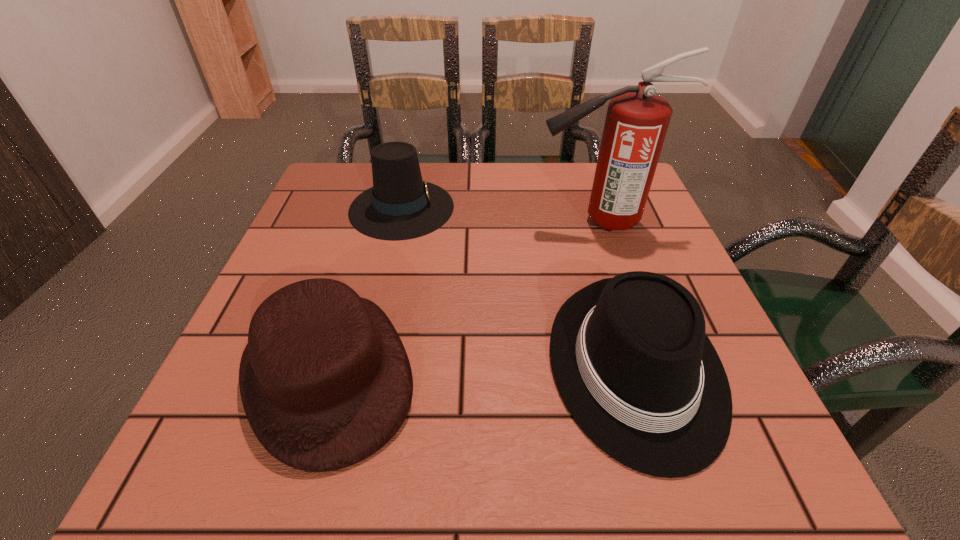
In the image, there is a desktop. Find the location of `free space at the near edge`. free space at the near edge is located at coordinates (513, 429).

This screenshot has height=540, width=960. What are the coordinates of `free spot at the left edge of the desktop` in the screenshot? It's located at (232, 385).

This screenshot has height=540, width=960. In the image, there is a desktop. What are the coordinates of `vacant space at the far left corner` in the screenshot? It's located at (305, 212).

Where is `vacant point located between the shorter hat and the taller hat`? This screenshot has width=960, height=540. vacant point located between the shorter hat and the taller hat is located at coordinates (366, 290).

Identify the location of free space between the fedora and the shorter hat. (483, 370).

At what (x,y) coordinates should I click in order to perform the action: click on unoccupied area between the farther hat and the shorter hat. Please return your answer as a coordinate pair (x, y). This screenshot has width=960, height=540. Looking at the image, I should click on (366, 290).

What are the coordinates of `free space between the shorter hat and the fedora` in the screenshot? It's located at (483, 370).

Image resolution: width=960 pixels, height=540 pixels. In order to click on vacant space in between the tallest object and the farther hat in this screenshot , I will do `click(500, 214)`.

You are a GUI agent. You are given a task and a screenshot of the screen. Output one action in this format:
    pyautogui.click(x=<x>, y=<y>)
    Task: Click on the free space between the fedora and the shorter hat
    The height and width of the screenshot is (540, 960).
    Given the screenshot: What is the action you would take?
    pyautogui.click(x=483, y=370)

I want to click on free space between the nearer hat and the tallest object, so click(x=464, y=297).